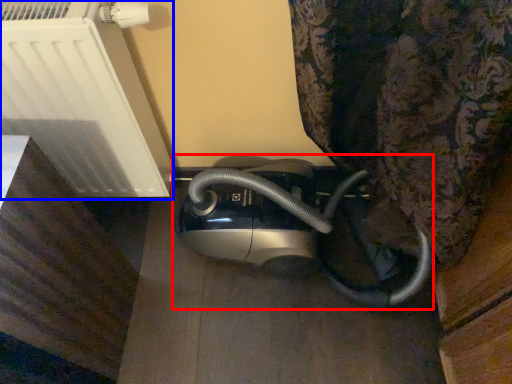
Question: Among these objects, which one is nearest to the camera, home appliance (highlighted by a red box) or appliance (highlighted by a blue box)?

Choices:
 (A) home appliance
 (B) appliance

Answer: (B)